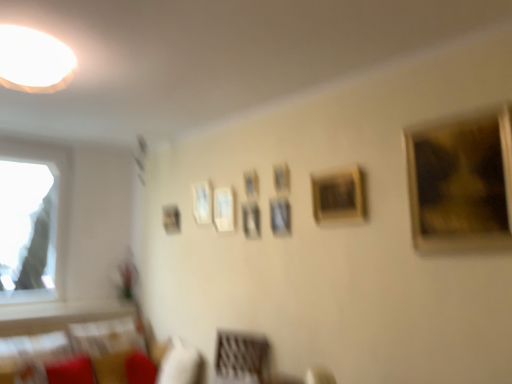
Question: Is wooden frame at center, which is counted as the eighth picture frame, starting from the left, in front of or behind wooden photo frame at center, which is the 6th picture frame in right-to-left order, in the image?

Choices:
 (A) front
 (B) behind

Answer: (A)

Question: Considering the positions of wooden frame at center, which is counted as the eighth picture frame, starting from the left, and wooden photo frame at center, the fourth picture frame in the left-to-right sequence, in the image, is wooden frame at center, which is counted as the eighth picture frame, starting from the left, wider or thinner than wooden photo frame at center, the fourth picture frame in the left-to-right sequence,?

Choices:
 (A) thin
 (B) wide

Answer: (B)

Question: Which is nearer to the transparent glass window at left?

Choices:
 (A) velvet beige couch at lower left
 (B) wooden picture frame at center, acting as the fifth picture frame starting from the right
 (C) matte white frame at upper center, which appears as the second picture frame when viewed from the left
 (D) gold textured painting at upper right, the 1th picture frame positioned from the right
 (E) wooden photo frame at center, acting as the 3th picture frame starting from the right

Answer: (A)

Question: Estimate the real-world distances between objects in this image. Which object is farther from the matte black picture frame at upper center, which is counted as the 1th picture frame, starting from the back?

Choices:
 (A) matte white frame at upper center, arranged as the 8th picture frame when viewed from the front
 (B) wooden frame at center, acting as the 8th picture frame starting from the back
 (C) wooden photo frame at center, which is counted as the 6th picture frame, starting from the front
 (D) white glossy light at upper left
 (E) velvet beige couch at lower left

Answer: (D)